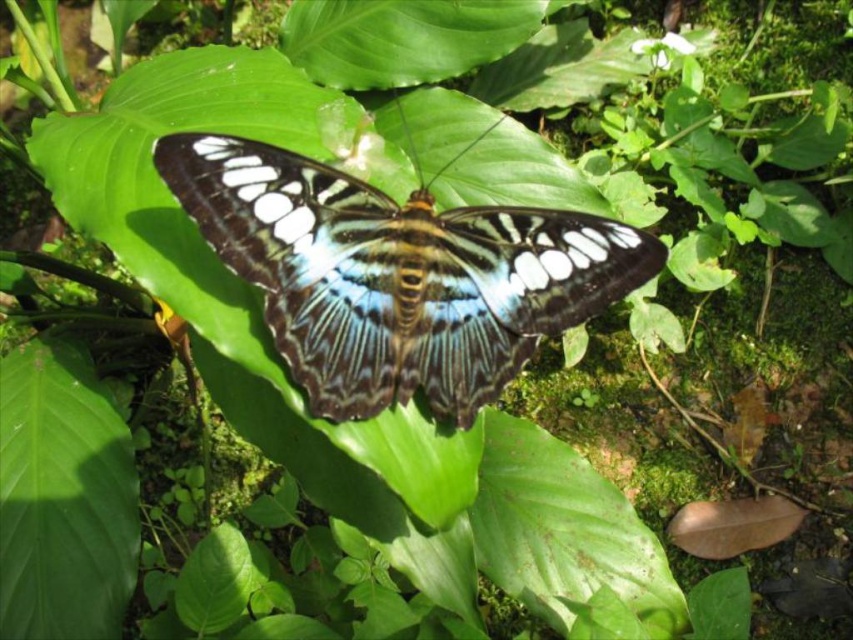
Between translucent iridescent butterfly at center and green matte leaf at center, which one is positioned lower?

Positioned lower is green matte leaf at center.

How much distance is there between translucent iridescent butterfly at center and green matte leaf at center?

A distance of 28.78 inches exists between translucent iridescent butterfly at center and green matte leaf at center.

Looking at this image, measure the distance between translucent iridescent butterfly at center and camera.

translucent iridescent butterfly at center is 1.07 meters away from camera.

What are the coordinates of `translucent iridescent butterfly at center` in the screenshot? It's located at [396, 275].